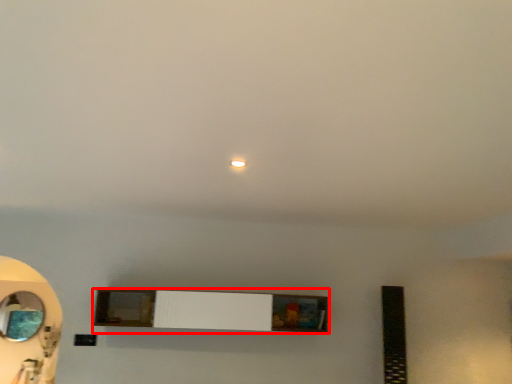
Question: From the image's perspective, where is shelf (annotated by the red box) located relative to mirror?

Choices:
 (A) above
 (B) below

Answer: (A)